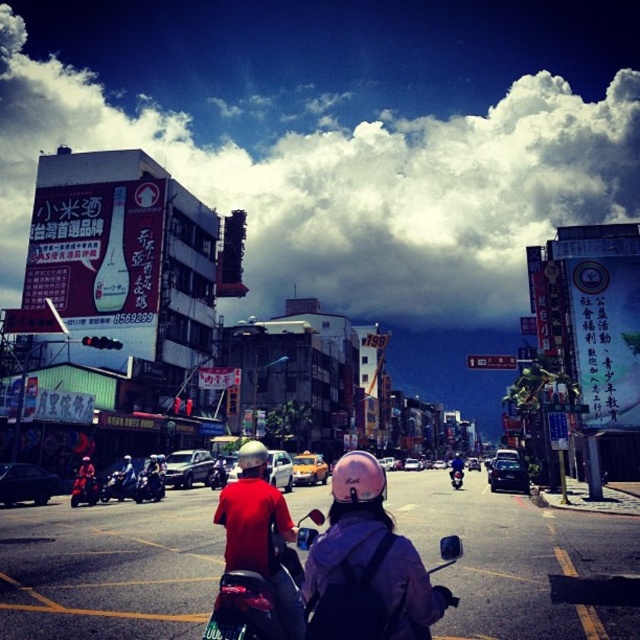
Question: Which point is farther to the camera?

Choices:
 (A) metallic pink helmet at center
 (B) red matte helmet at center
 (C) shiny red motorcycle at center-left

Answer: (A)

Question: Is red matte helmet at center further to camera compared to shiny red motorcycle at center-left?

Choices:
 (A) no
 (B) yes

Answer: (A)

Question: Does red matte helmet at center have a larger size compared to metallic pink helmet at center?

Choices:
 (A) no
 (B) yes

Answer: (B)

Question: Which object is farther from the camera taking this photo?

Choices:
 (A) shiny red motorcycle at center-left
 (B) red matte helmet at center
 (C) metallic pink helmet at center

Answer: (C)

Question: Can you confirm if shiny red motorcycle at center-left is smaller than metallic pink helmet at center?

Choices:
 (A) no
 (B) yes

Answer: (B)

Question: Which object is the farthest from the red matte helmet at center?

Choices:
 (A) shiny red motorcycle at center-left
 (B) metallic pink helmet at center

Answer: (B)